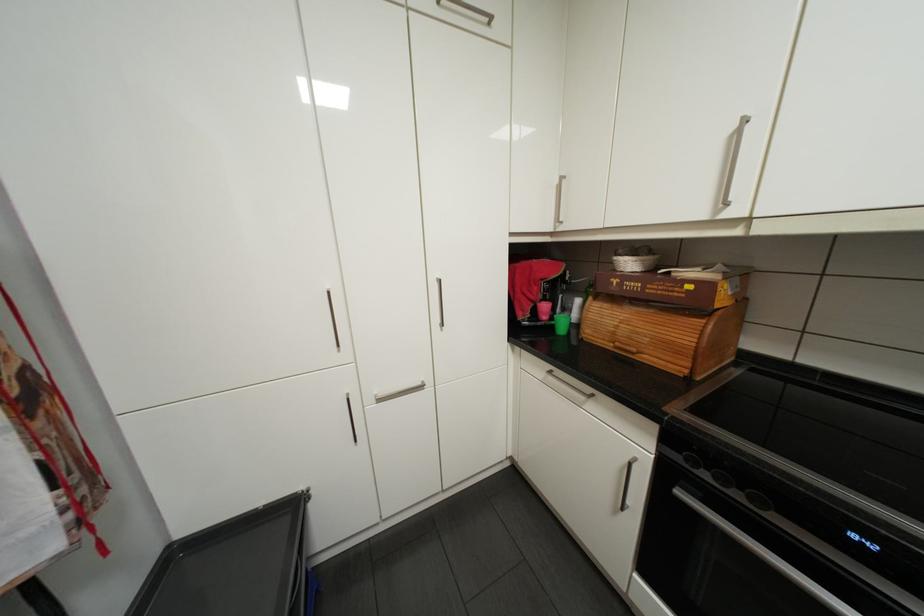
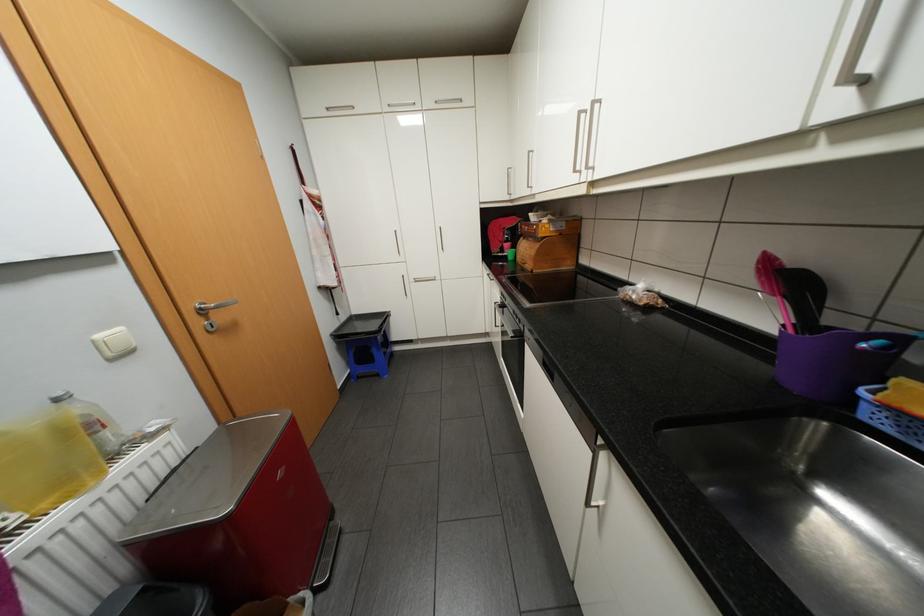
In the second image, find the point that corresponds to pixel 602 297 in the first image.

(531, 237)